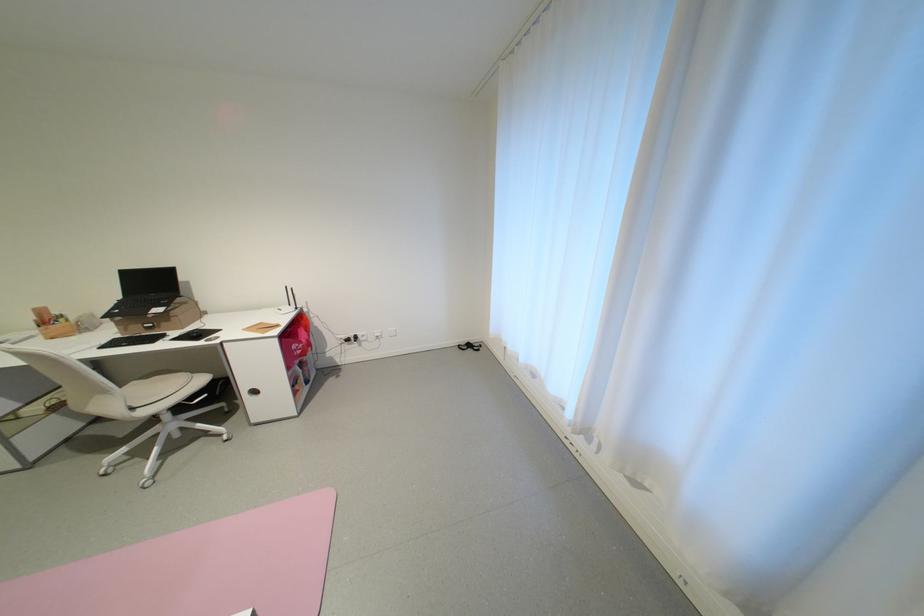
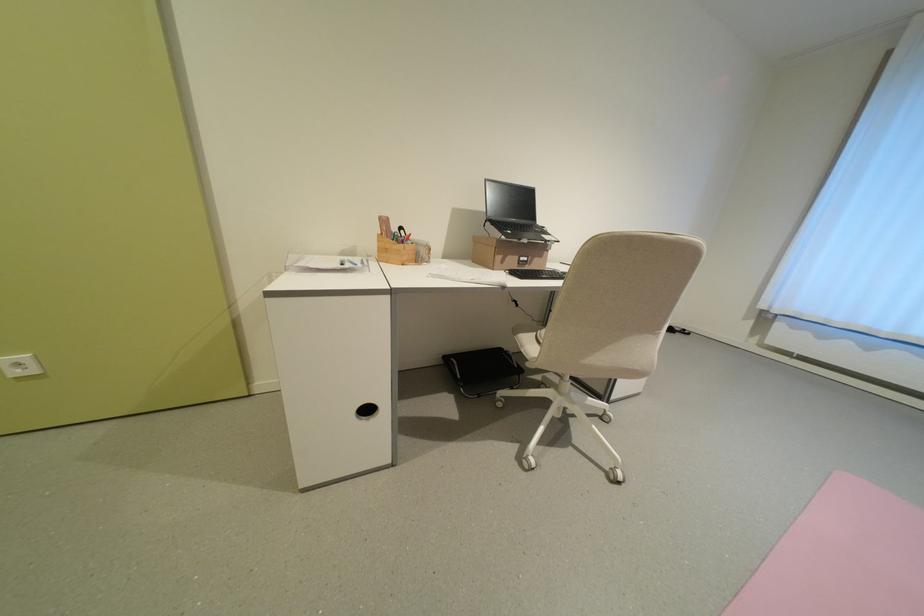
Question: The images are taken continuously from a first-person perspective. In which direction are you moving?

Choices:
 (A) Left
 (B) Right
 (C) Forward
 (D) Backward

Answer: (A)